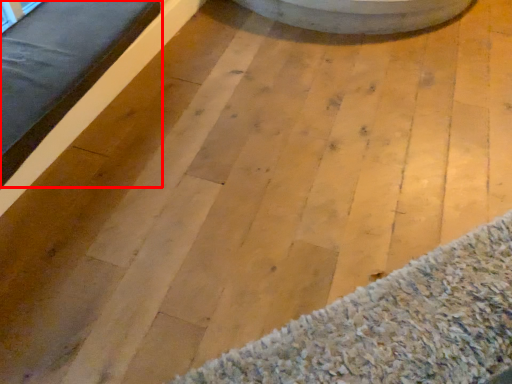
Question: From the image's perspective, considering the relative positions of furniture (annotated by the red box) and mat in the image provided, where is furniture (annotated by the red box) located with respect to the staircase?

Choices:
 (A) above
 (B) below

Answer: (A)